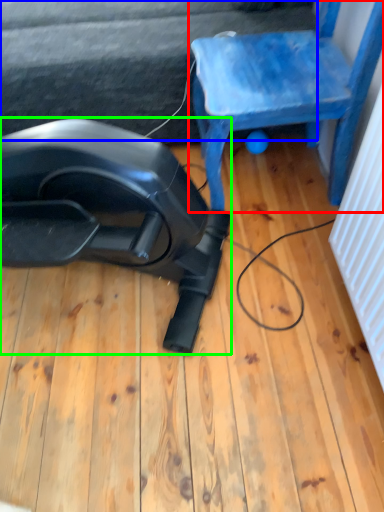
Question: Considering the real-world distances, which object is closest to chair (highlighted by a red box)? surface (highlighted by a blue box) or equipment (highlighted by a green box).

Choices:
 (A) surface
 (B) equipment

Answer: (A)